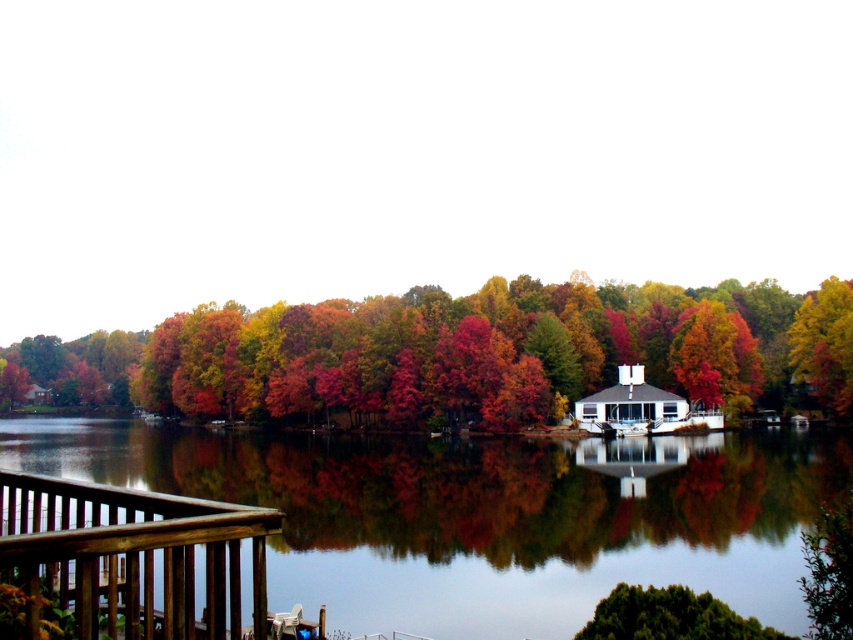
You are standing on a deck overlooking a lake and see the autumn leaves at center and the brown wooden railing at lower left. Which object is closer to you?

The autumn leaves at center are closer to you than the brown wooden railing at lower left because they are positioned further to the viewer in the scene.

You are standing on a deck overlooking a lake and see the autumn leaves at center and the brown wooden railing at lower left. Which object is closer to the water surface?

The autumn leaves at center are closer to the water surface because they are positioned below the brown wooden railing at lower left, which is higher up from the water.